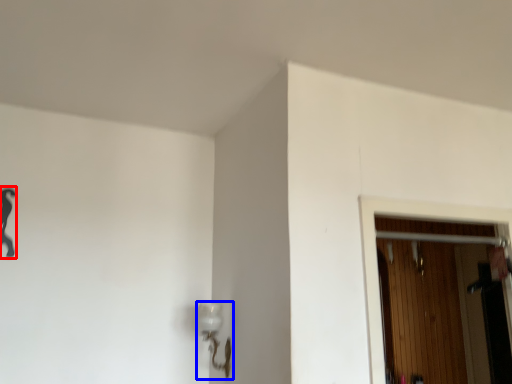
Question: Which object appears farthest to the camera in this image, woman (highlighted by a red box) or lamp (highlighted by a blue box)?

Choices:
 (A) woman
 (B) lamp

Answer: (B)